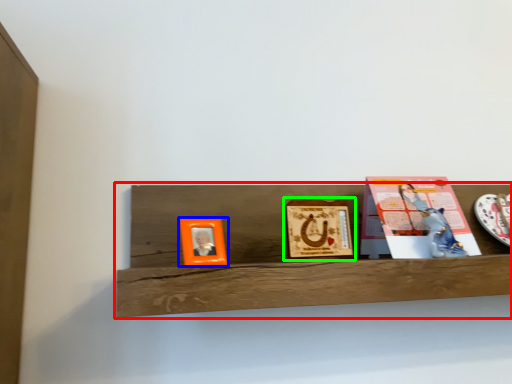
Question: Based on their relative distances, which object is farther from shelf (highlighted by a red box)? Choose from picture frame (highlighted by a blue box) and picture frame (highlighted by a green box).

Choices:
 (A) picture frame
 (B) picture frame

Answer: (A)